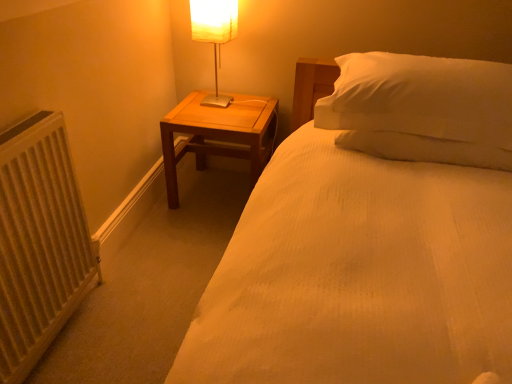
The height and width of the screenshot is (384, 512). In order to click on free space underneath white textured radiator at left (from a real-world perspective) in this screenshot , I will do `click(69, 334)`.